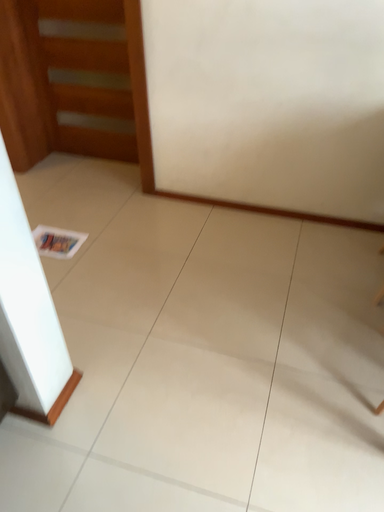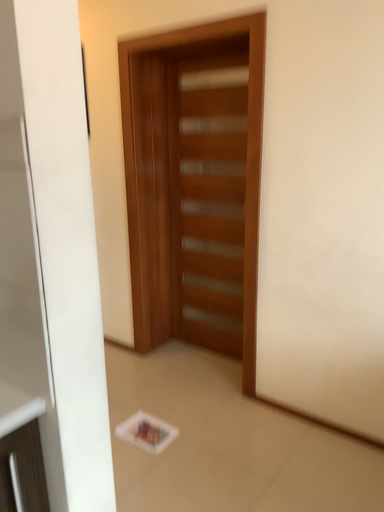
Question: Which way did the camera rotate in the video?

Choices:
 (A) rotated downward
 (B) rotated upward

Answer: (B)